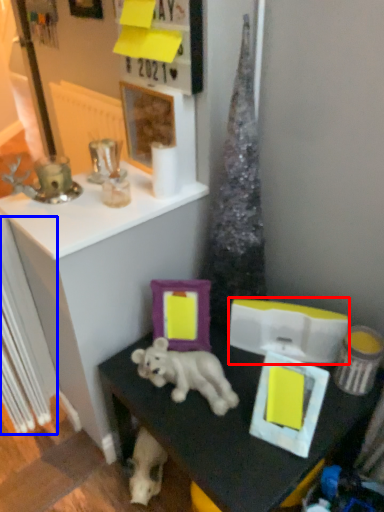
Question: Which object is further to the camera taking this photo, box (highlighted by a red box) or radiator (highlighted by a blue box)?

Choices:
 (A) box
 (B) radiator

Answer: (A)